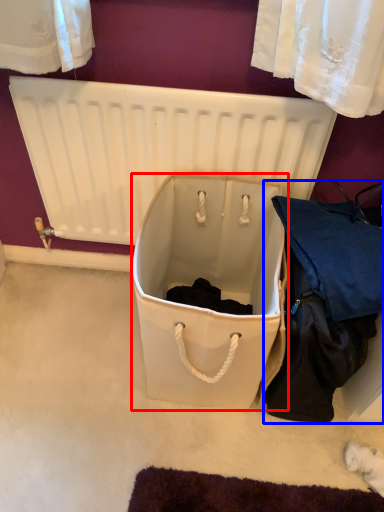
Question: Which of the following is the closest to the observer, storage box (highlighted by a red box) or clothing (highlighted by a blue box)?

Choices:
 (A) storage box
 (B) clothing

Answer: (B)